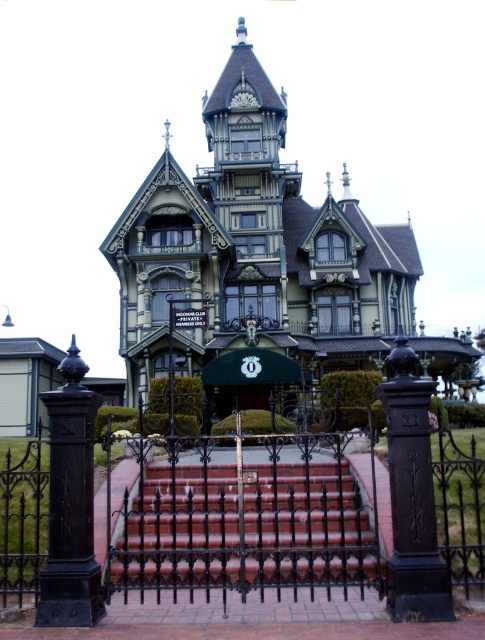
Is green wood mansion at center below black wrought iron post at left?

No, green wood mansion at center is not below black wrought iron post at left.

Can you confirm if green wood mansion at center is positioned above black wrought iron post at left?

Yes.

Is point (214, 298) positioned in front of point (62, 467)?

No, it is not.

Identify the location of green wood mansion at center. (263, 260).

Who is positioned more to the right, green wood mansion at center or black wrought iron gate at center?

green wood mansion at center is more to the right.

What do you see at coordinates (263, 260) in the screenshot?
I see `green wood mansion at center` at bounding box center [263, 260].

I want to click on green wood mansion at center, so point(263,260).

This screenshot has width=485, height=640. Identify the location of green wood mansion at center. (263, 260).

Can you confirm if black wrought iron gate at center is thinner than green fabric street sign at center?

In fact, black wrought iron gate at center might be wider than green fabric street sign at center.

Is point (200, 531) positioned behind point (207, 326)?

No, it is not.

Between point (122, 476) and point (207, 323), which one is positioned behind?

The point (207, 323) is more distant.

Where is `black wrought iron gate at center`? The height and width of the screenshot is (640, 485). black wrought iron gate at center is located at coordinates (242, 515).